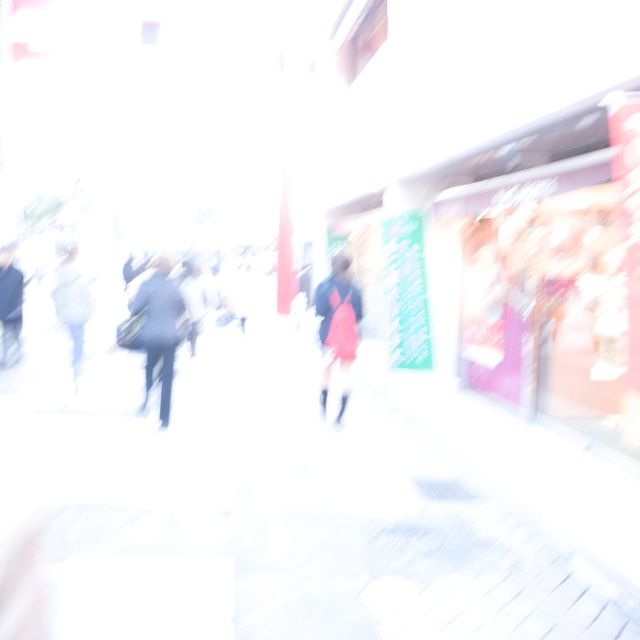
You are a fashion designer observing a busy street scene. You notice two individuals dressed in dark blue suit at center and dark gray suit at left. Which of these two suits is positioned to the right in the image?

The dark blue suit at center is positioned to the right of the dark gray suit at left.

Based on the scene description, what is located at the coordinates point (296, 516)?

The white concrete pavement at center is located at point (296, 516).

You are a photographer who just took a picture of a busy street in a city. You notice that the image is overexposed, making most details hard to see. However, you recall that there was a person wearing a dark blue suit standing at a specific location. Using the coordinates provided, can you determine if the dark blue suit at center is positioned closer to the top or bottom of the image?

The dark blue suit at center is located at point (157, 330). Since the y coordinate is 0.248, which is closer to 0.0 than 1.0, the dark blue suit at center is positioned closer to the bottom of the image.